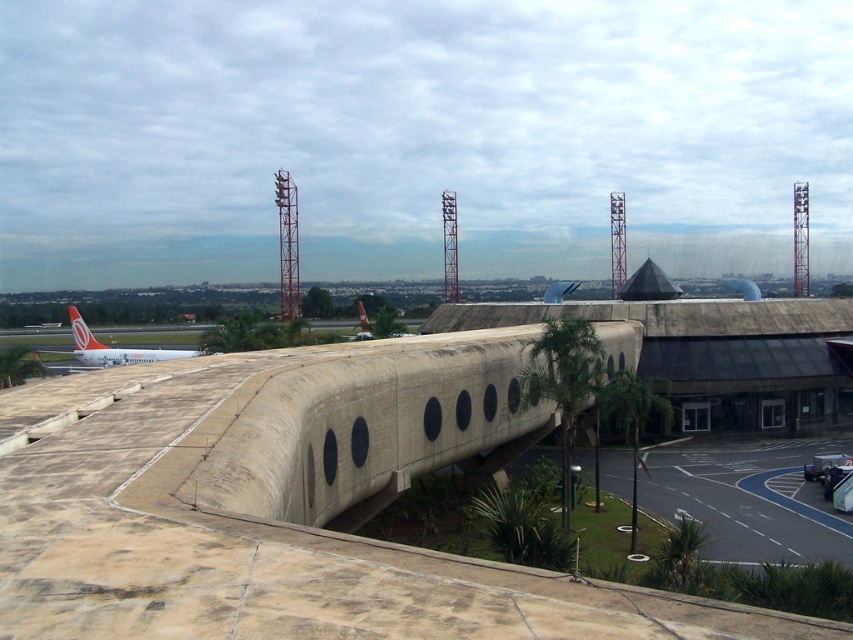
You are a pilot preparing to land a small aircraft. You observe the scene and notice the black asphalt at lower right and the matte orange airplane at left. Which of these two areas is more suitable for landing your aircraft?

The matte orange airplane at left is larger than the black asphalt at lower right, so the matte orange airplane at left would be more suitable for landing your aircraft.

You are standing at the curved concrete bridge and see two points marked on the structure. The first point is at coordinates point (650, 461) and the second is at point (86, 355). Which point is closer to you?

Point (650, 461) is in front of point (86, 355), so the first point is closer to you.